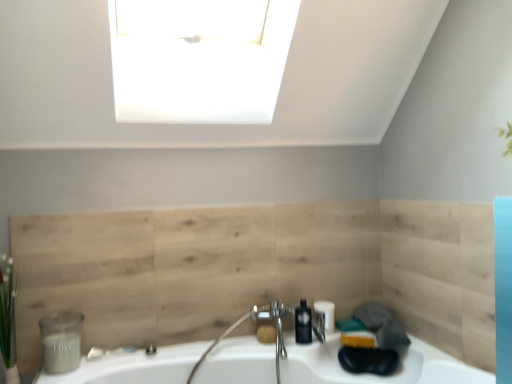
What do you see at coordinates (266, 334) in the screenshot? I see `matte brown soap at center` at bounding box center [266, 334].

Image resolution: width=512 pixels, height=384 pixels. Describe the element at coordinates (303, 323) in the screenshot. I see `black matte soap dispenser at center` at that location.

What do you see at coordinates (61, 341) in the screenshot?
I see `matte gray container at lower left, the second toiletry positioned from the right` at bounding box center [61, 341].

What do you see at coordinates (258, 319) in the screenshot? The width and height of the screenshot is (512, 384). I see `polished chrome faucet at center` at bounding box center [258, 319].

This screenshot has height=384, width=512. I want to click on natural wood paneling at center, so click(258, 270).

From the picture: Is green leafy plant at left wider than matte brown soap at center?

Correct, the width of green leafy plant at left exceeds that of matte brown soap at center.

Are green leafy plant at left and matte brown soap at center located far from each other?

green leafy plant at left is positioned a significant distance from matte brown soap at center.

Does point (7, 279) come closer to viewer compared to point (269, 339)?

Yes, it is in front of point (269, 339).

In the scene shown: From a real-world perspective, does matte brown soap at center sit lower than black matte soap dispenser at center?

Correct, in the physical world, matte brown soap at center is lower than black matte soap dispenser at center.

From the image's perspective, would you say matte brown soap at center is positioned over black matte soap dispenser at center?

No, from the image's perspective, matte brown soap at center is not over black matte soap dispenser at center.

Are matte brown soap at center and black matte soap dispenser at center far apart?

matte brown soap at center is actually quite close to black matte soap dispenser at center.

Does black matte soap dispenser at center have a larger size compared to green leafy plant at left?

Incorrect, black matte soap dispenser at center is not larger than green leafy plant at left.

Is black matte soap dispenser at center not close to green leafy plant at left?

black matte soap dispenser at center is far away from green leafy plant at left.

Measure the distance from black matte soap dispenser at center to green leafy plant at left.

1.28 meters.

Which of these two, black matte soap dispenser at center or green leafy plant at left, is thinner?

black matte soap dispenser at center is thinner.

In the scene shown: How distant is matte black toiletry at lower center, acting as the 2th toiletry starting from the front, from green leafy plant at left?

matte black toiletry at lower center, acting as the 2th toiletry starting from the front, and green leafy plant at left are 1.42 meters apart.

Does matte black toiletry at lower center, arranged as the second toiletry when viewed from the left, have a smaller size compared to green leafy plant at left?

Correct, matte black toiletry at lower center, arranged as the second toiletry when viewed from the left, occupies less space than green leafy plant at left.

Considering the positions of points (325, 329) and (15, 283), is point (325, 329) closer to camera compared to point (15, 283)?

No, (325, 329) is further to viewer.

Is matte black toiletry at lower center, arranged as the second toiletry when viewed from the left, wider than green leafy plant at left?

Incorrect, the width of matte black toiletry at lower center, arranged as the second toiletry when viewed from the left, does not surpass that of green leafy plant at left.

From the image's perspective, is green leafy plant at left positioned above or below natural wood paneling at center?

From the image's perspective, green leafy plant at left appears below natural wood paneling at center.

In the image, is green leafy plant at left on the left side or the right side of natural wood paneling at center?

green leafy plant at left is to the left of natural wood paneling at center.

Is green leafy plant at left in front of or behind natural wood paneling at center in the image?

green leafy plant at left is in front of natural wood paneling at center.

Is polished chrome faucet at center facing away from matte gray container at lower left, marked as the first toiletry in a left-to-right arrangement?

polished chrome faucet at center does not have its back to matte gray container at lower left, marked as the first toiletry in a left-to-right arrangement.

Which is behind, polished chrome faucet at center or matte gray container at lower left, the second toiletry in the back-to-front sequence?

polished chrome faucet at center is further away from the camera.

Between polished chrome faucet at center and matte gray container at lower left, the 1th toiletry when ordered from front to back, which one has smaller size?

matte gray container at lower left, the 1th toiletry when ordered from front to back.

Considering the relative sizes of polished chrome faucet at center and matte gray container at lower left, the second toiletry in the back-to-front sequence, in the image provided, is polished chrome faucet at center shorter than matte gray container at lower left, the second toiletry in the back-to-front sequence,?

No, polished chrome faucet at center is not shorter than matte gray container at lower left, the second toiletry in the back-to-front sequence.

From a real-world perspective, which object rests below the other?

polished chrome faucet at center is physically lower.

Which is in front, point (295, 318) or point (275, 307)?

The point (295, 318) is closer to the camera.

Locate an element on the screen. soap dispenser on the right side of polished chrome faucet at center is located at coordinates (303, 323).

Can we say black matte soap dispenser at center lies outside polished chrome faucet at center?

No.

You are a GUI agent. You are given a task and a screenshot of the screen. Output one action in this format:
    pyautogui.click(x=<x>, y=<y>)
    Task: Click on the plant on the left of matte brown soap at center
    Image resolution: width=512 pixels, height=384 pixels.
    Given the screenshot: What is the action you would take?
    pyautogui.click(x=8, y=309)

Identify the location of soap dispenser on the right of matte brown soap at center. The width and height of the screenshot is (512, 384). (303, 323).

Estimate the real-world distances between objects in this image. Which object is further from matte black toiletry at lower center, the first toiletry viewed from the right, black matte soap dispenser at center or polished chrome faucet at center?

polished chrome faucet at center.

Looking at the image, which one is located further to natural wood paneling at center, matte black toiletry at lower center, the first toiletry viewed from the right, or black matte soap dispenser at center?

matte black toiletry at lower center, the first toiletry viewed from the right, is positioned further to the anchor natural wood paneling at center.

Looking at the image, which one is located further to matte gray container at lower left, marked as the first toiletry in a left-to-right arrangement, green leafy plant at left or white glossy sink at lower center?

white glossy sink at lower center is positioned further to the anchor matte gray container at lower left, marked as the first toiletry in a left-to-right arrangement.

Based on their spatial positions, is matte gray container at lower left, the 1th toiletry when ordered from front to back, or matte brown soap at center closer to matte black toiletry at lower center, acting as the first toiletry starting from the back?

Among the two, matte brown soap at center is located nearer to matte black toiletry at lower center, acting as the first toiletry starting from the back.

Estimate the real-world distances between objects in this image. Which object is further from natural wood paneling at center, matte black toiletry at lower center, arranged as the second toiletry when viewed from the left, or matte brown soap at center?

matte brown soap at center is positioned further to the anchor natural wood paneling at center.

When comparing their distances from matte black toiletry at lower center, arranged as the second toiletry when viewed from the left, does black matte soap dispenser at center or matte brown soap at center seem closer?

The object closer to matte black toiletry at lower center, arranged as the second toiletry when viewed from the left, is black matte soap dispenser at center.

Estimate the real-world distances between objects in this image. Which object is closer to matte black toiletry at lower center, acting as the 2th toiletry starting from the front, black matte soap dispenser at center or green leafy plant at left?

Based on the image, black matte soap dispenser at center appears to be nearer to matte black toiletry at lower center, acting as the 2th toiletry starting from the front.

Looking at this image, from the image, which object appears to be nearer to natural wood paneling at center, matte brown soap at center or white glossy sink at lower center?

The object closer to natural wood paneling at center is white glossy sink at lower center.

Locate an element on the screen. The height and width of the screenshot is (384, 512). toiletry between green leafy plant at left and matte black toiletry at lower center, the first toiletry viewed from the right, from left to right is located at coordinates (61, 341).

Identify the location of soap between natural wood paneling at center and matte black toiletry at lower center, the first toiletry viewed from the right. (266, 334).

Locate an element on the screen. faucet between green leafy plant at left and white glossy sink at lower center is located at coordinates (258, 319).

At what (x,y) coordinates should I click in order to perform the action: click on toiletry between green leafy plant at left and polished chrome faucet at center in the horizontal direction. Please return your answer as a coordinate pair (x, y). Looking at the image, I should click on (61, 341).